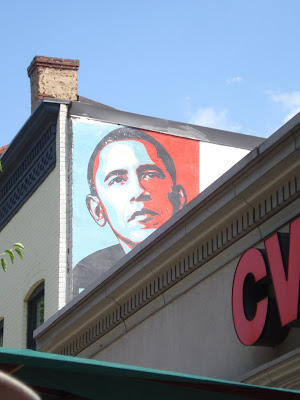
Identify the location of window. This screenshot has height=400, width=300. (25, 313).